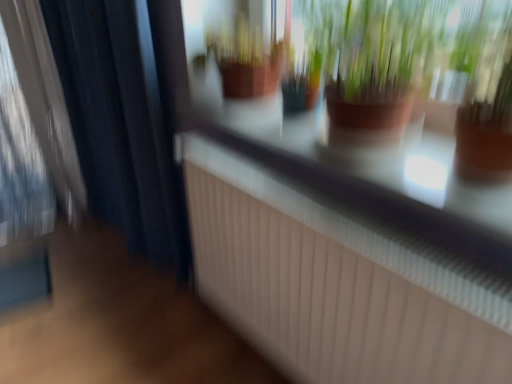
Question: Should I look upward or downward to see brown clay pot at upper center?

Choices:
 (A) down
 (B) up

Answer: (B)

Question: Is brown clay pot at upper center in front of dark blue fabric curtain at left?

Choices:
 (A) no
 (B) yes

Answer: (B)

Question: From the image's perspective, is brown clay pot at upper center on dark blue fabric curtain at left?

Choices:
 (A) yes
 (B) no

Answer: (B)

Question: Can we say brown clay pot at upper center lies outside dark blue fabric curtain at left?

Choices:
 (A) yes
 (B) no

Answer: (A)

Question: Is brown clay pot at upper center positioned behind dark blue fabric curtain at left?

Choices:
 (A) no
 (B) yes

Answer: (A)

Question: Can you confirm if brown clay pot at upper center is wider than dark blue fabric curtain at left?

Choices:
 (A) yes
 (B) no

Answer: (A)

Question: Does brown clay pot at upper center have a lesser height compared to dark blue fabric curtain at left?

Choices:
 (A) no
 (B) yes

Answer: (B)

Question: From a real-world perspective, is dark blue fabric curtain at left on brown clay pot at upper center?

Choices:
 (A) yes
 (B) no

Answer: (B)

Question: Is the depth of dark blue fabric curtain at left less than that of brown clay pot at upper center?

Choices:
 (A) no
 (B) yes

Answer: (A)

Question: Could you tell me if dark blue fabric curtain at left is facing brown clay pot at upper center?

Choices:
 (A) yes
 (B) no

Answer: (B)

Question: From the image's perspective, does dark blue fabric curtain at left appear higher than brown clay pot at upper center?

Choices:
 (A) no
 (B) yes

Answer: (B)

Question: Considering the relative positions of dark blue fabric curtain at left and brown clay pot at upper center in the image provided, is dark blue fabric curtain at left to the right of brown clay pot at upper center from the viewer's perspective?

Choices:
 (A) yes
 (B) no

Answer: (B)

Question: Does dark blue fabric curtain at left have a smaller size compared to brown clay pot at upper center?

Choices:
 (A) no
 (B) yes

Answer: (A)

Question: Is brown clay pot at upper center wider or thinner than dark blue fabric curtain at left?

Choices:
 (A) wide
 (B) thin

Answer: (A)